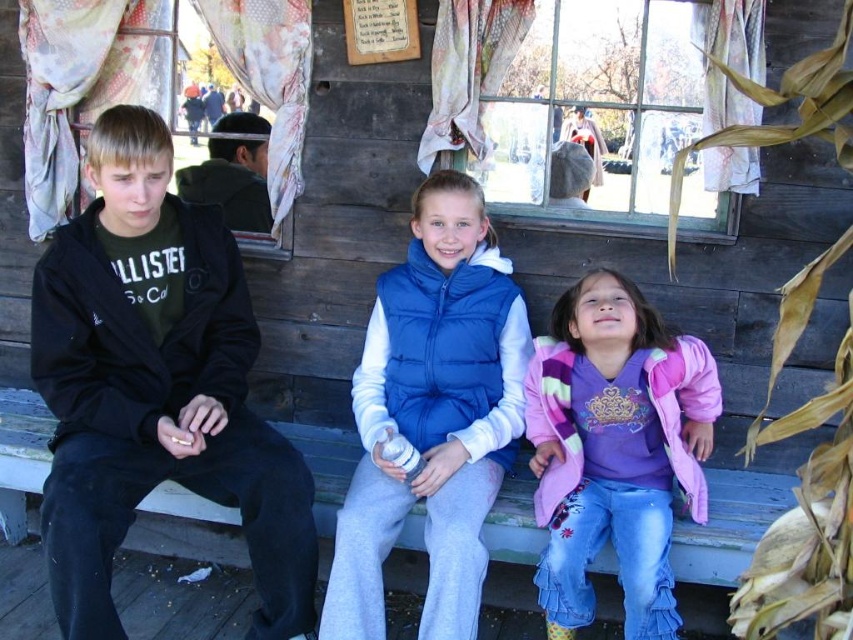
You are a tailor who needs to know the jacket sizes to alter them. Which jacket has a larger width, the black matte jacket at left or the pink fleece jacket at lower right?

The black matte jacket at left has a larger width than the pink fleece jacket at lower right according to the description.

You are a photographer setting up for a group photo. You need to position the blue puffy vest at center and the pink fleece jacket at lower right in the frame. Which object should be placed on the left side of the frame?

The blue puffy vest at center should be placed on the left side of the frame because it is to the left of the pink fleece jacket at lower right according to the description.